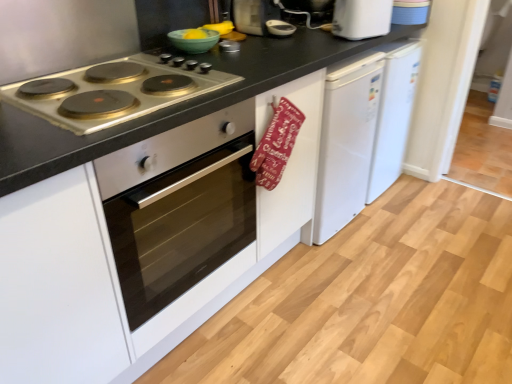
Locate an element on the screen. This screenshot has width=512, height=384. vacant space in red fabric oven mitt at center (from a real-world perspective) is located at coordinates (281, 293).